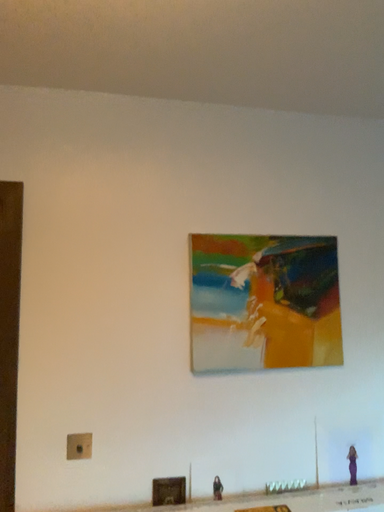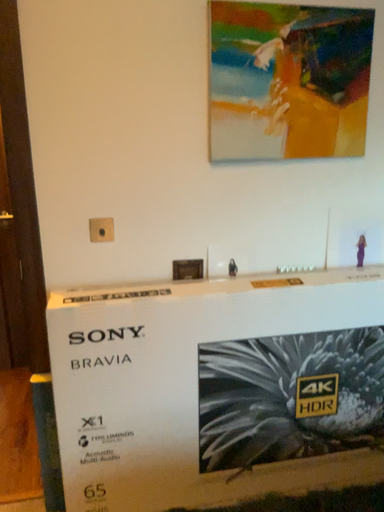
Question: How did the camera likely rotate when shooting the video?

Choices:
 (A) rotated downward
 (B) rotated upward

Answer: (A)